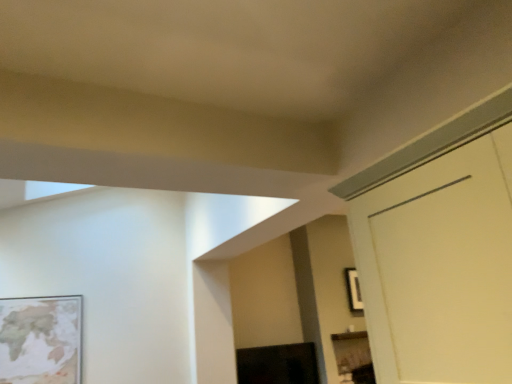
The width and height of the screenshot is (512, 384). In order to click on matte paper map at lower left in this screenshot , I will do `click(41, 339)`.

Image resolution: width=512 pixels, height=384 pixels. What do you see at coordinates (41, 339) in the screenshot?
I see `matte paper map at lower left` at bounding box center [41, 339].

Where is `matte paper map at lower left`? This screenshot has height=384, width=512. matte paper map at lower left is located at coordinates (41, 339).